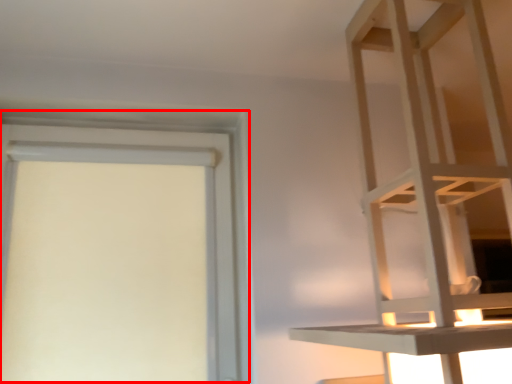
Question: In this image, where is bay window (annotated by the red box) located relative to furniture?

Choices:
 (A) left
 (B) right

Answer: (A)